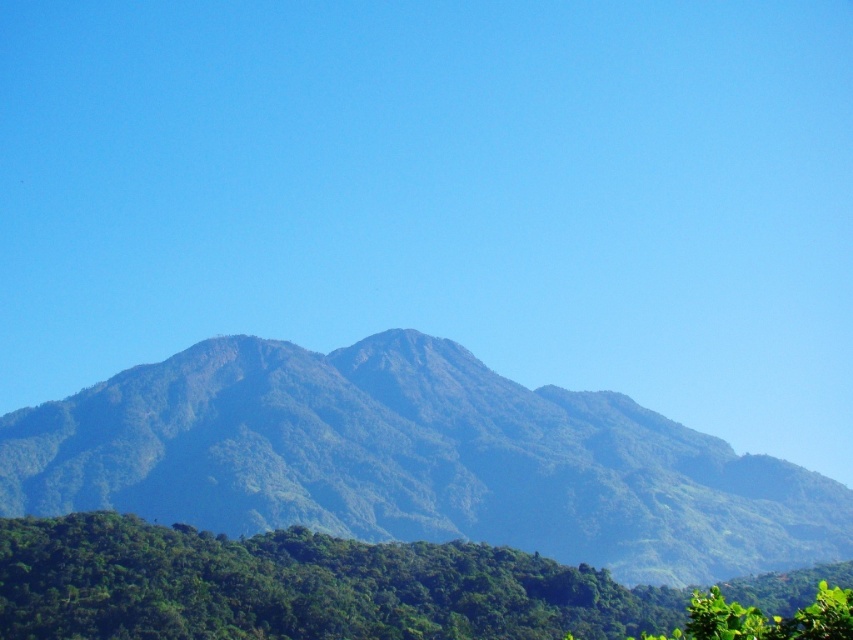
Does green leafy mountain range at center appear on the left side of green leafy tree at lower center?

Indeed, green leafy mountain range at center is positioned on the left side of green leafy tree at lower center.

Which of these two, green leafy mountain range at center or green leafy tree at lower center, stands shorter?

Standing shorter between the two is green leafy tree at lower center.

The width and height of the screenshot is (853, 640). Describe the element at coordinates (416, 460) in the screenshot. I see `green leafy mountain range at center` at that location.

You are a GUI agent. You are given a task and a screenshot of the screen. Output one action in this format:
    pyautogui.click(x=<x>, y=<y>)
    Task: Click on the green leafy mountain range at center
    
    Given the screenshot: What is the action you would take?
    pyautogui.click(x=416, y=460)